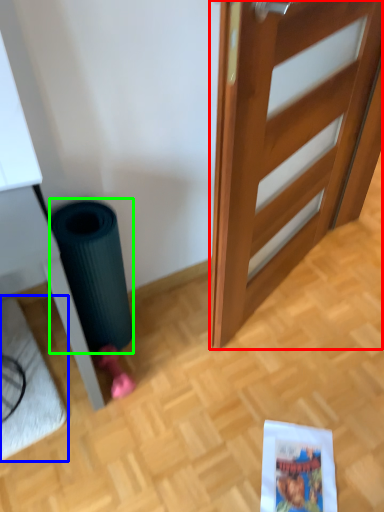
Question: Based on their relative distances, which object is nearer to door (highlighted by a red box)? Choose from doormat (highlighted by a blue box) and garbage (highlighted by a green box).

Choices:
 (A) doormat
 (B) garbage

Answer: (B)